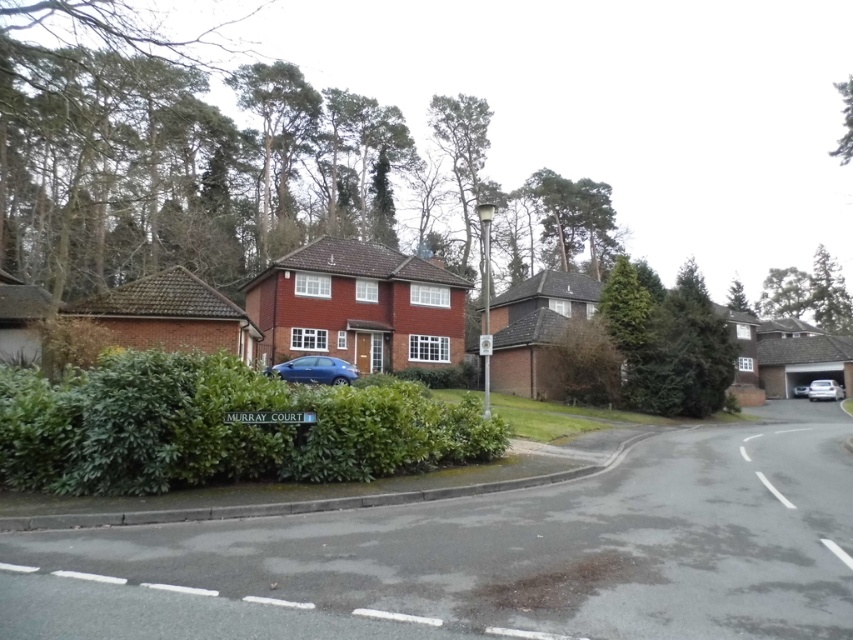
Does green leafy hedge at center appear on the right side of white glossy car at right?

Incorrect, green leafy hedge at center is not on the right side of white glossy car at right.

The height and width of the screenshot is (640, 853). Describe the element at coordinates (219, 428) in the screenshot. I see `green leafy hedge at center` at that location.

Locate an element on the screen. Image resolution: width=853 pixels, height=640 pixels. green leafy hedge at center is located at coordinates (219, 428).

Measure the distance between glossy blue car at center and camera.

22.68 meters

Is glossy blue car at center thinner than silver metallic car at right?

In fact, glossy blue car at center might be wider than silver metallic car at right.

Locate an element on the screen. The image size is (853, 640). glossy blue car at center is located at coordinates (315, 371).

The image size is (853, 640). I want to click on glossy blue car at center, so click(x=315, y=371).

Between silver metallic car at right and white glossy car at right, which one has more height?

With more height is silver metallic car at right.

Who is more distant from viewer, (x=827, y=397) or (x=798, y=387)?

Result: The point (x=798, y=387) is behind.

Image resolution: width=853 pixels, height=640 pixels. Find the location of `silver metallic car at right`. silver metallic car at right is located at coordinates (824, 388).